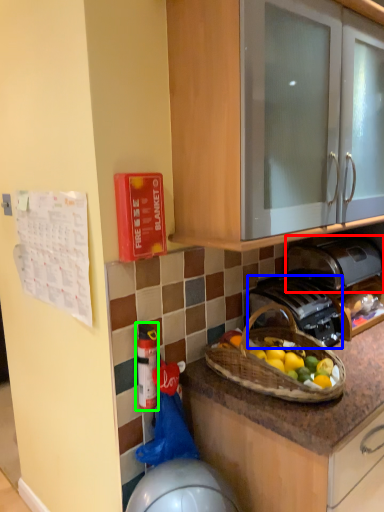
Question: Based on their relative distances, which object is nearer to toaster (highlighted by a red box)? Choose from gas stove (highlighted by a blue box) and extinguisher (highlighted by a green box).

Choices:
 (A) gas stove
 (B) extinguisher

Answer: (A)